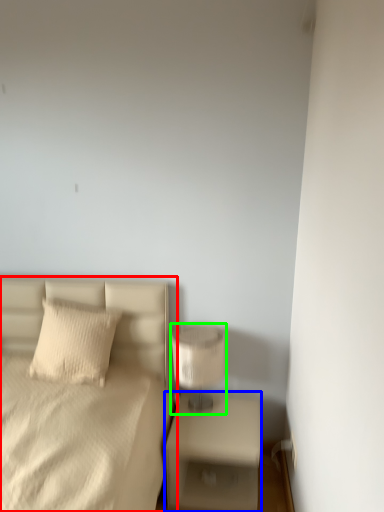
Question: Which is nearer to the bed (highlighted by a red box)? nightstand (highlighted by a blue box) or table lamp (highlighted by a green box).

Choices:
 (A) nightstand
 (B) table lamp

Answer: (B)